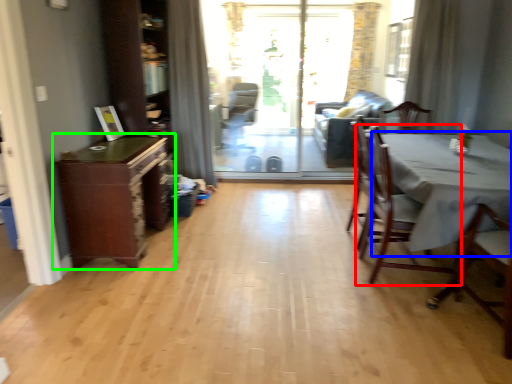
Question: Which is nearer to the chair (highlighted by a red box)? table (highlighted by a blue box) or cabinetry (highlighted by a green box).

Choices:
 (A) table
 (B) cabinetry

Answer: (A)